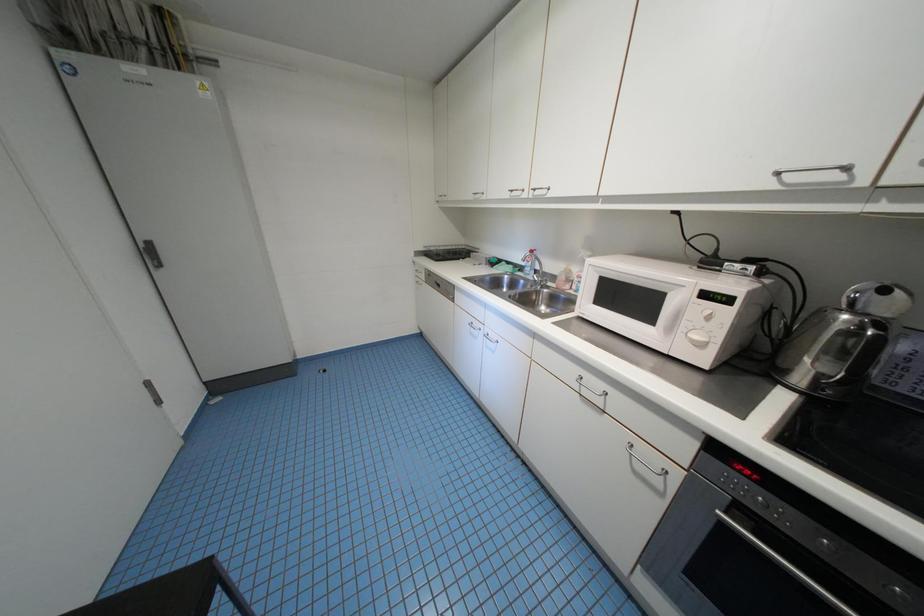
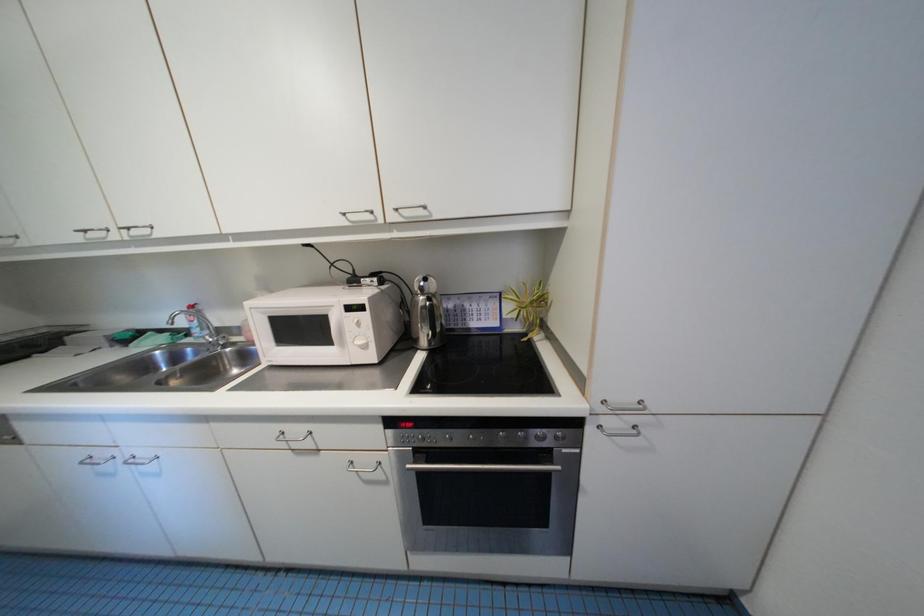
Question: The first image is from the beginning of the video and the second image is from the end. How did the camera likely rotate when shooting the video?

Choices:
 (A) Left
 (B) Right
 (C) Up
 (D) Down

Answer: (B)